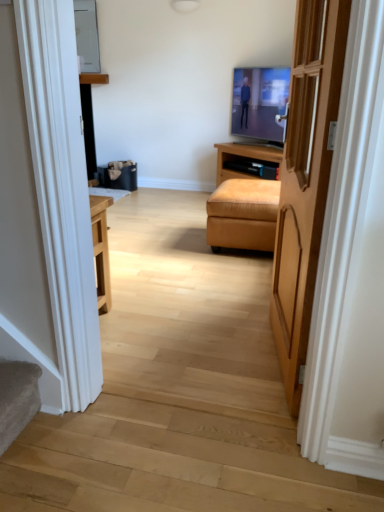
Where is `free space in front of suede-like tan ottoman at center`? This screenshot has height=512, width=384. free space in front of suede-like tan ottoman at center is located at coordinates (226, 267).